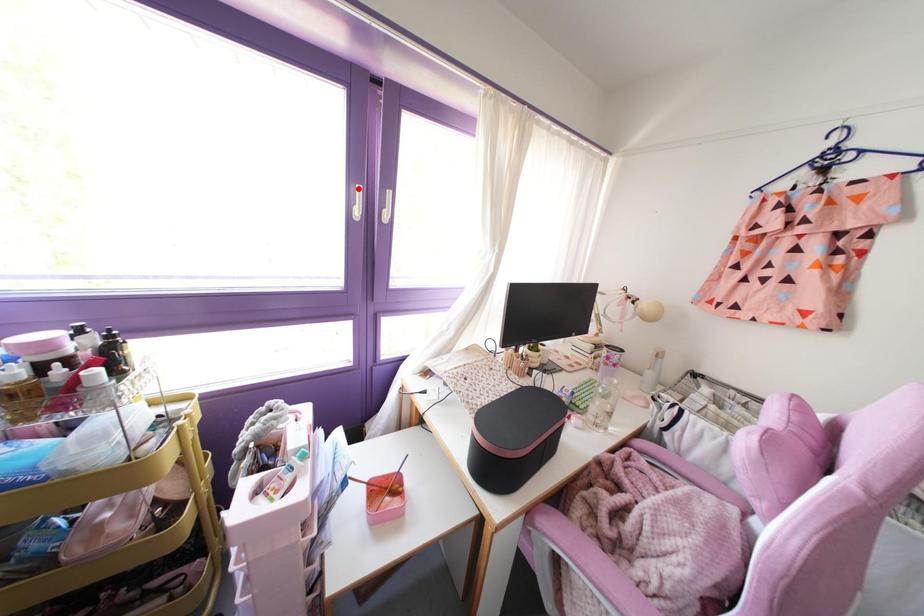
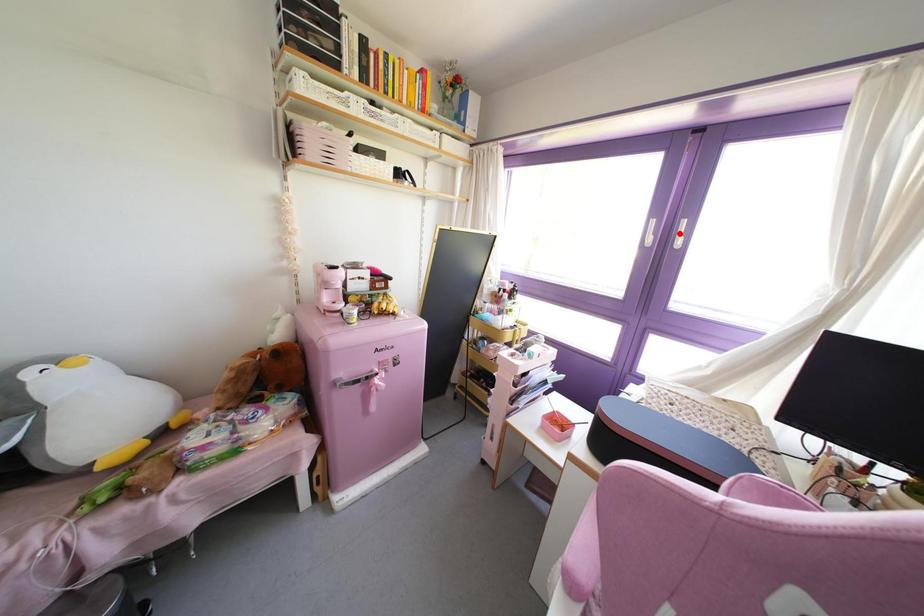
I am providing you with two images of the same scene from different viewpoints. A red point is marked on the first image and another point is marked on the second image. Does the point marked in image1 correspond to the same location as the one in image2?

No